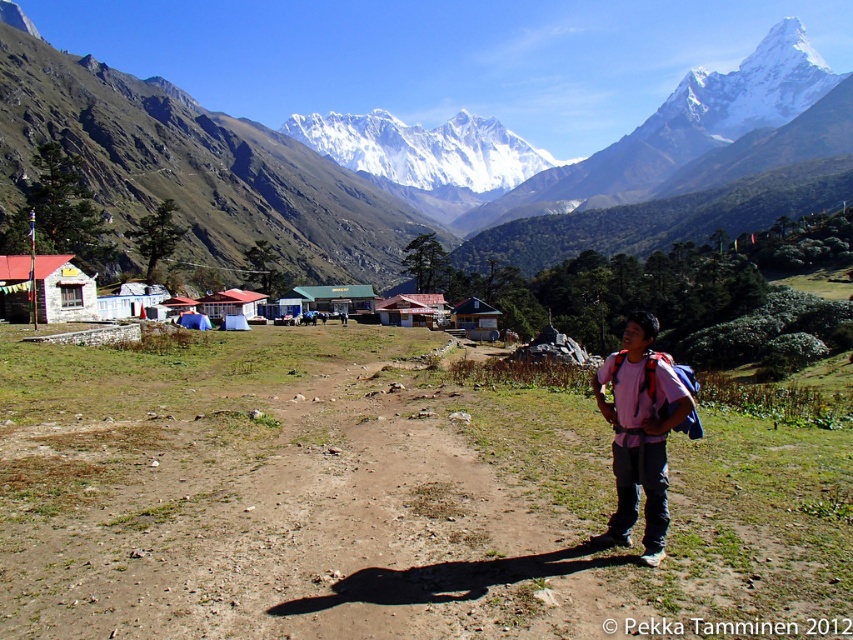
Question: Considering the real-world distances, which object is closest to the white corrugated metal huts at center?

Choices:
 (A) matte red wooden hut at left
 (B) brown wooden hut at center

Answer: (A)

Question: Which point is farther to the camera?

Choices:
 (A) matte red wooden hut at left
 (B) white corrugated metal huts at center
 (C) white corrugated metal hut at center
 (D) brown wooden hut at center

Answer: (D)

Question: Can you confirm if matte red wooden hut at left is smaller than brown corrugated metal hut at center?

Choices:
 (A) yes
 (B) no

Answer: (A)

Question: Which object appears farthest from the camera in this image?

Choices:
 (A) matte red wooden hut at center
 (B) white corrugated metal huts at center
 (C) brown dirt track at center
 (D) brown wooden hut at center

Answer: (D)

Question: Is green corrugated metal hut at center further to the viewer compared to brown wooden hut at center?

Choices:
 (A) no
 (B) yes

Answer: (B)

Question: Does brown dirt track at center have a smaller size compared to matte red wooden hut at left?

Choices:
 (A) no
 (B) yes

Answer: (A)